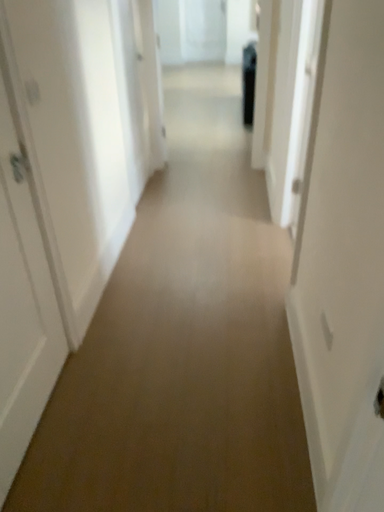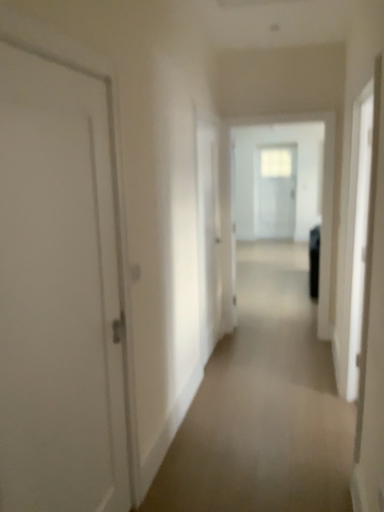
Question: How did the camera likely rotate when shooting the video?

Choices:
 (A) rotated upward
 (B) rotated downward

Answer: (A)